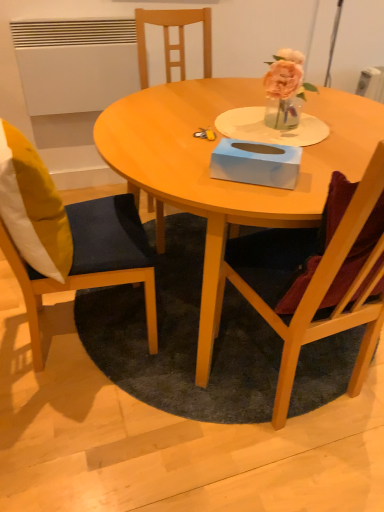
The height and width of the screenshot is (512, 384). I want to click on vacant region under wooden chair at left, the first chair in the left-to-right sequence (from a real-world perspective), so click(70, 331).